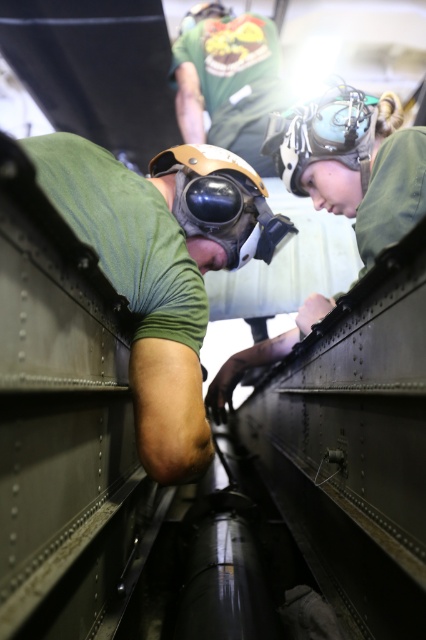
Question: Does green matte helmet at center have a larger size compared to matte black helmet at center?

Choices:
 (A) no
 (B) yes

Answer: (B)

Question: Can you confirm if green matte helmet at center is wider than matte black helmet at center?

Choices:
 (A) yes
 (B) no

Answer: (A)

Question: Does green matte helmet at center have a larger size compared to matte black helmet at center?

Choices:
 (A) no
 (B) yes

Answer: (B)

Question: Which of the following is the closest to the observer?

Choices:
 (A) green matte helmet at center
 (B) matte black helmet at center

Answer: (A)